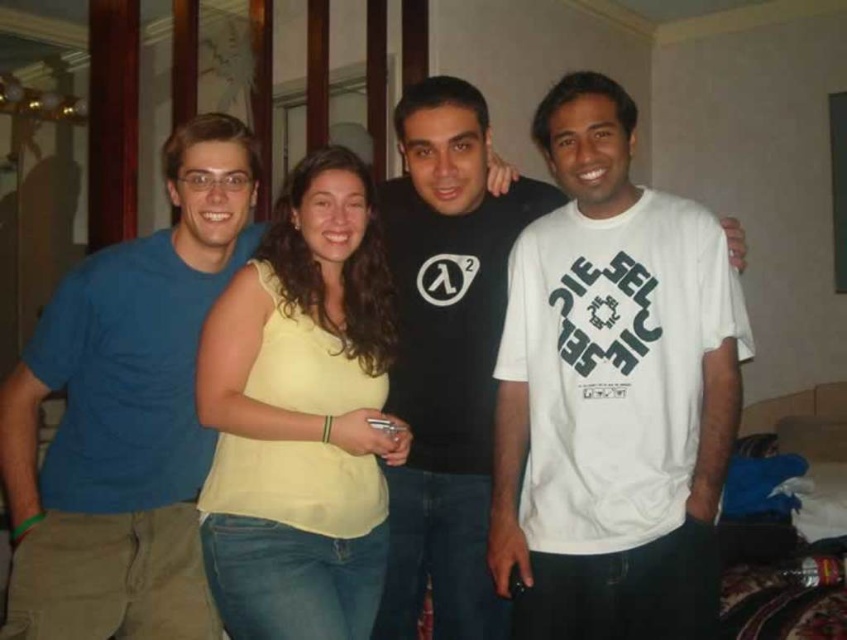
Is blue cotton t-shirt at left above yellow fabric shirt at center?

Indeed, blue cotton t-shirt at left is positioned over yellow fabric shirt at center.

Is blue cotton t-shirt at left positioned behind yellow fabric shirt at center?

Yes.

The height and width of the screenshot is (640, 847). I want to click on blue cotton t-shirt at left, so click(126, 413).

Does yellow fabric shirt at center have a greater height compared to black matte t-shirt at center?

No, yellow fabric shirt at center is not taller than black matte t-shirt at center.

Does point (266, 417) come in front of point (386, 609)?

Yes, point (266, 417) is in front of point (386, 609).

This screenshot has height=640, width=847. Find the location of `yellow fabric shirt at center`. yellow fabric shirt at center is located at coordinates (302, 417).

Who is positioned more to the left, blue cotton t-shirt at left or black matte t-shirt at center?

From the viewer's perspective, blue cotton t-shirt at left appears more on the left side.

Does point (239, 204) come behind point (446, 506)?

No, (239, 204) is in front of (446, 506).

In order to click on blue cotton t-shirt at left in this screenshot , I will do `click(126, 413)`.